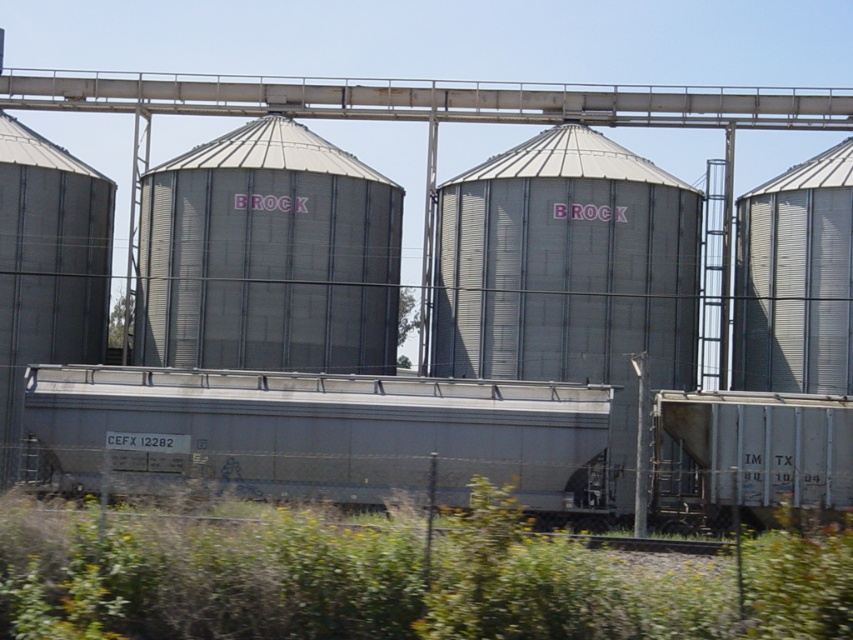
In the scene shown: You are a train conductor who needs to load grain into the nearest silo. You are currently standing next to the freight train. Which silo is closer to you, the metallic gray silo at center or the metallic silver silo at right?

The metallic silver silo at right is closer to you because it is below the metallic gray silo at center, meaning it is positioned lower and thus nearer in the scene.

You are standing at the origin point of the coordinate system. You want to walk to the silver metallic train car at center. Which direction should you go?

The silver metallic train car at center is located at coordinate point (323,435), so you should move northeast to reach it.